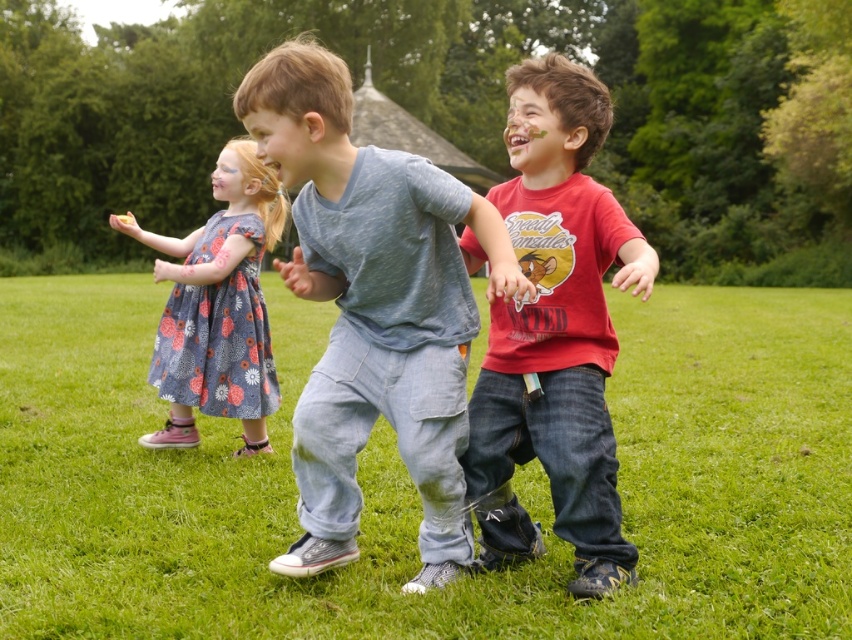
Question: Which object is the closest to the light blue cotton shirt at center?

Choices:
 (A) floral-patterned dress at left
 (B) denim pants at center
 (C) matte red t-shirt at center

Answer: (C)

Question: Is matte red t-shirt at center below floral-patterned dress at left?

Choices:
 (A) no
 (B) yes

Answer: (B)

Question: Among these points, which one is farthest from the camera?

Choices:
 (A) (176, 365)
 (B) (432, 289)
 (C) (531, 444)

Answer: (A)

Question: In this image, where is denim pants at center located relative to matte red t-shirt at center?

Choices:
 (A) below
 (B) above

Answer: (B)

Question: Among these objects, which one is farthest from the camera?

Choices:
 (A) matte red t-shirt at center
 (B) denim pants at center
 (C) floral-patterned dress at left
 (D) light blue cotton shirt at center

Answer: (C)

Question: Where is light blue cotton shirt at center located in relation to matte red t-shirt at center in the image?

Choices:
 (A) left
 (B) right

Answer: (A)